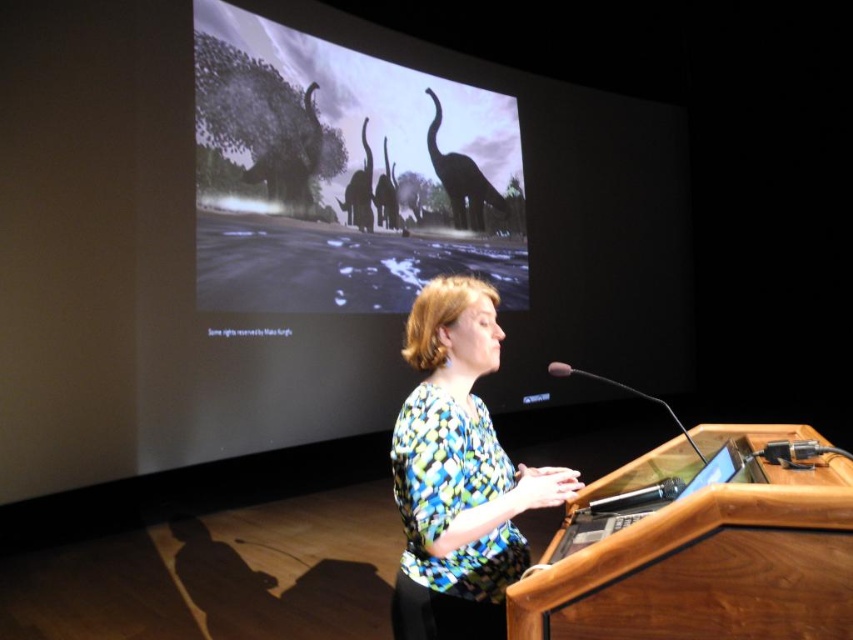
Who is positioned more to the left, silhouette matte elephants at upper center or wooden podium at center?

From the viewer's perspective, silhouette matte elephants at upper center appears more on the left side.

This screenshot has height=640, width=853. Find the location of `silhouette matte elephants at upper center`. silhouette matte elephants at upper center is located at coordinates (343, 173).

Find the location of a particular element. Image resolution: width=853 pixels, height=640 pixels. silhouette matte elephants at upper center is located at coordinates (343, 173).

Is silhouette matte elephants at upper center wider than printed fabric blouse at center?

Yes.

Who is more forward, [331,163] or [488,449]?

Point [488,449] is more forward.

Image resolution: width=853 pixels, height=640 pixels. Find the location of `silhouette matte elephants at upper center`. silhouette matte elephants at upper center is located at coordinates (343, 173).

Locate an element on the screen. wooden podium at center is located at coordinates (703, 560).

Is wooden podium at center wider than printed fabric blouse at center?

Correct, the width of wooden podium at center exceeds that of printed fabric blouse at center.

Who is more forward, (537, 620) or (453, 563)?

Positioned in front is point (537, 620).

Where is `wooden podium at center`? This screenshot has width=853, height=640. wooden podium at center is located at coordinates (703, 560).